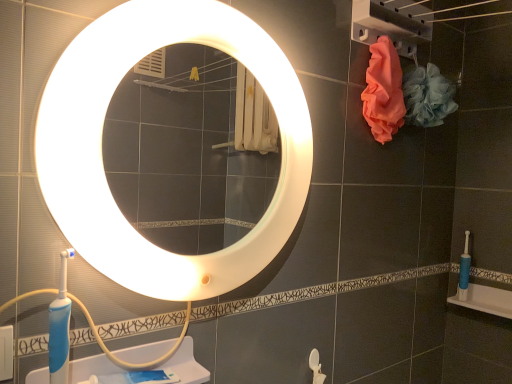
Question: Would you say white plastic sink at lower left is inside or outside pink fabric at upper right?

Choices:
 (A) outside
 (B) inside

Answer: (A)

Question: Is white plastic sink at lower left in front of or behind pink fabric at upper right in the image?

Choices:
 (A) front
 (B) behind

Answer: (A)

Question: Estimate the real-world distances between objects in this image. Which object is closer to the white glossy mirror at upper center?

Choices:
 (A) blue plastic toothbrush at lower right
 (B) blue plastic toothbrush at lower right
 (C) white plastic sink at lower left
 (D) pink fabric at upper right

Answer: (C)

Question: Estimate the real-world distances between objects in this image. Which object is farther from the blue plastic toothbrush at lower right?

Choices:
 (A) blue plastic toothbrush at lower right
 (B) white plastic sink at lower left
 (C) white glossy mirror at upper center
 (D) pink fabric at upper right

Answer: (B)